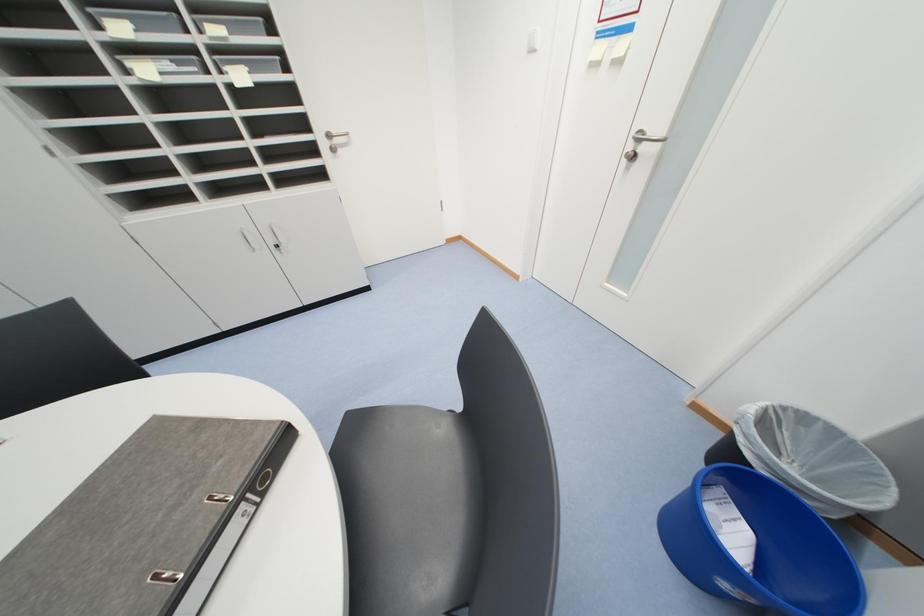
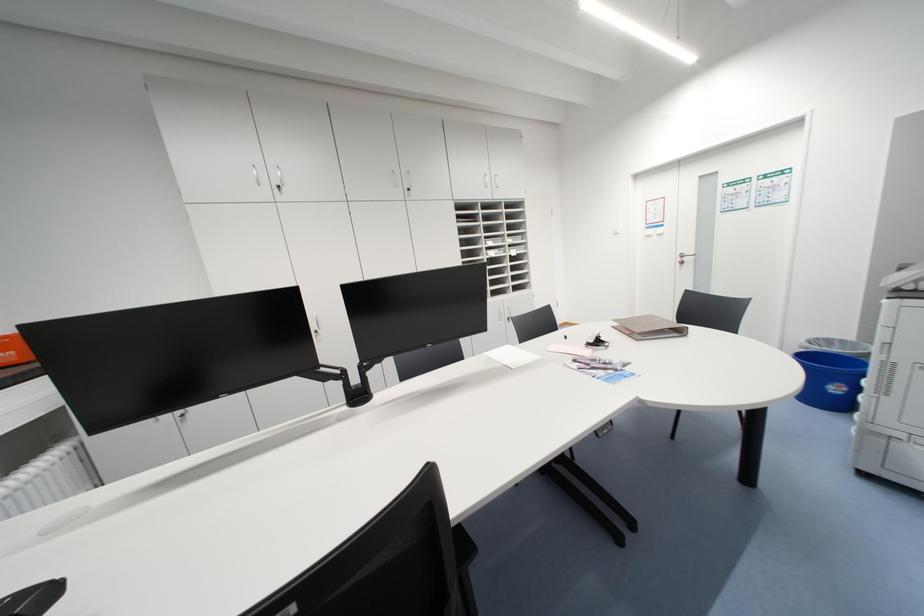
What movement of the cameraman would produce the second image?

The cameraman moved toward left, backward.